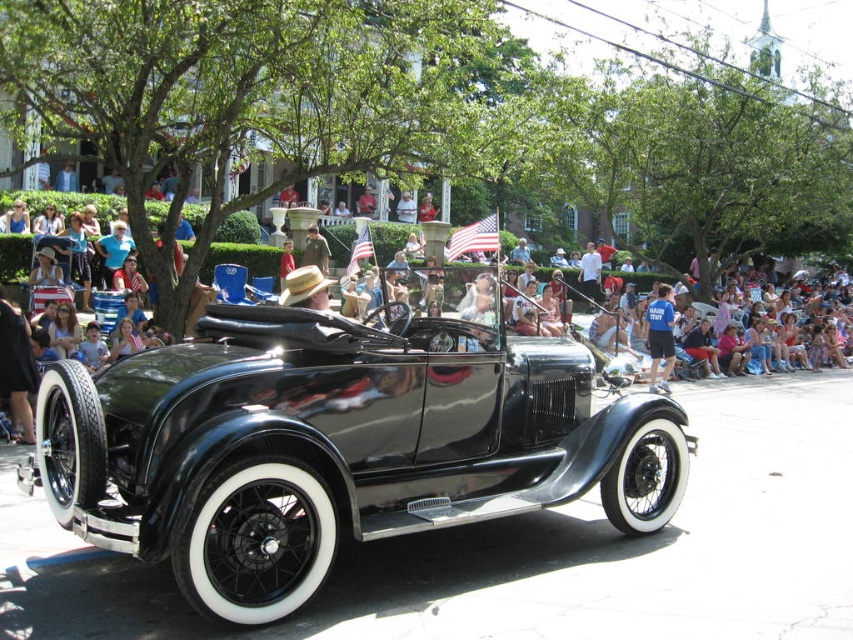
You are a photographer at the parade event. You want to take a photo of the shiny black car at center and the blue cotton shirt at center. Which one is positioned higher in the frame?

The shiny black car at center is located above the blue cotton shirt at center, so it is positioned higher in the frame.

You are a photographer standing at the location of the blue cotton shirt at center. You want to take a photo of the matte black car at center. Given that your camera has a maximum focus range of 50 feet, will you be able to capture the car in focus?

The matte black car at center is 49.32 feet from the blue cotton shirt at center. Since the distance is less than 50 feet, the camera can focus on the matte black car at center.